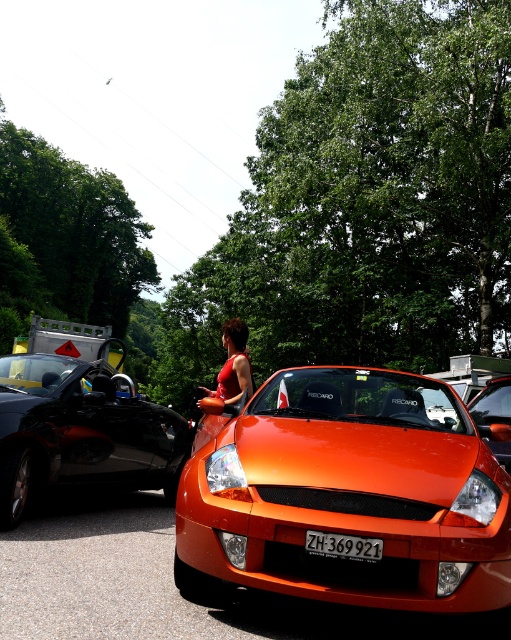
Question: Which object is farther from the camera taking this photo?

Choices:
 (A) matte red dress at center
 (B) black plastic license plate at center
 (C) glossy black car at left
 (D) orange matte sports car at center

Answer: (D)

Question: Is orange glossy sports car at center closer to camera compared to orange glossy car at center?

Choices:
 (A) yes
 (B) no

Answer: (B)

Question: Can you confirm if orange glossy car at center is positioned to the left of matte red dress at center?

Choices:
 (A) yes
 (B) no

Answer: (B)

Question: Which point appears farthest from the camera in this image?

Choices:
 (A) (317, 492)
 (B) (90, 524)

Answer: (B)

Question: Among these points, which one is nearest to the camera?

Choices:
 (A) (221, 384)
 (B) (311, 593)
 (C) (478, 413)
 (D) (340, 548)

Answer: (B)

Question: Can you confirm if glossy black car at left is thinner than black plastic license plate at center?

Choices:
 (A) no
 (B) yes

Answer: (A)